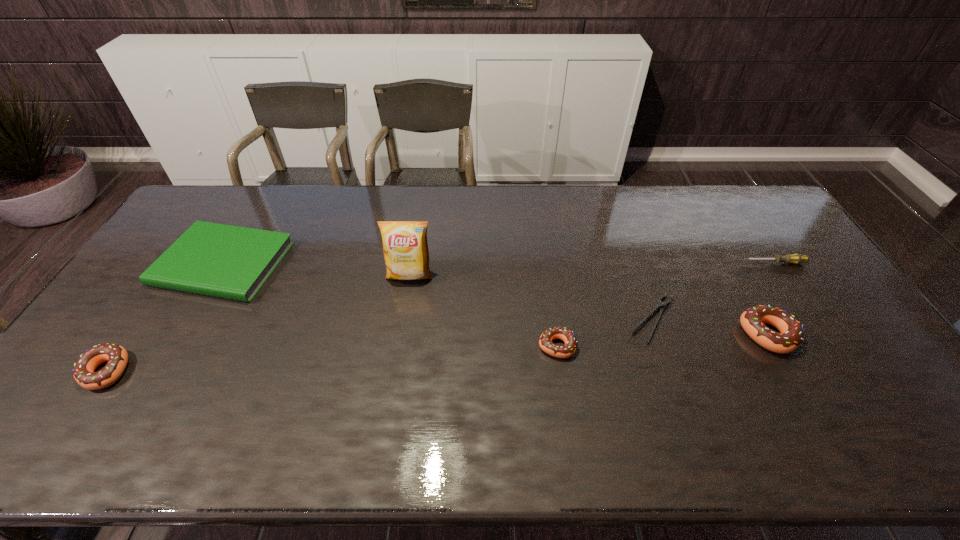
Identify the location of the fifth object from right to left. Image resolution: width=960 pixels, height=540 pixels. [405, 247].

Find the location of a particular element. the tallest object is located at coordinates (405, 247).

You are a GUI agent. You are given a task and a screenshot of the screen. Output one action in this format:
    pyautogui.click(x=<x>, y=<y>)
    Task: Click on the free spot located on the right of the third tallest object
    Image resolution: width=960 pixels, height=540 pixels.
    Given the screenshot: What is the action you would take?
    pyautogui.click(x=275, y=371)

Locate an element on the screen. The height and width of the screenshot is (540, 960). vacant region located 0.110m on the right of the second doughnut from left to right is located at coordinates (617, 346).

At what (x,y) coordinates should I click in order to perform the action: click on vacant space located on the left of the rightmost doughnut. Please return your answer as a coordinate pair (x, y). The width and height of the screenshot is (960, 540). Looking at the image, I should click on (683, 335).

Locate an element on the screen. This screenshot has width=960, height=540. free region located at the tip of the screwdriver is located at coordinates (655, 263).

The height and width of the screenshot is (540, 960). What are the coordinates of `free space located 0.310m at the tip of the screwdriver` in the screenshot? It's located at (645, 263).

At what (x,y) coordinates should I click in order to perform the action: click on vacant region located 0.350m at the tip of the screwdriver. Please return your answer as a coordinate pair (x, y). This screenshot has width=960, height=540. Looking at the image, I should click on (633, 263).

Where is `vacant space located 0.080m on the front of the paperback book`? vacant space located 0.080m on the front of the paperback book is located at coordinates (187, 326).

Locate an element on the screen. vacant space located on the left of the third object from right to left is located at coordinates (558, 319).